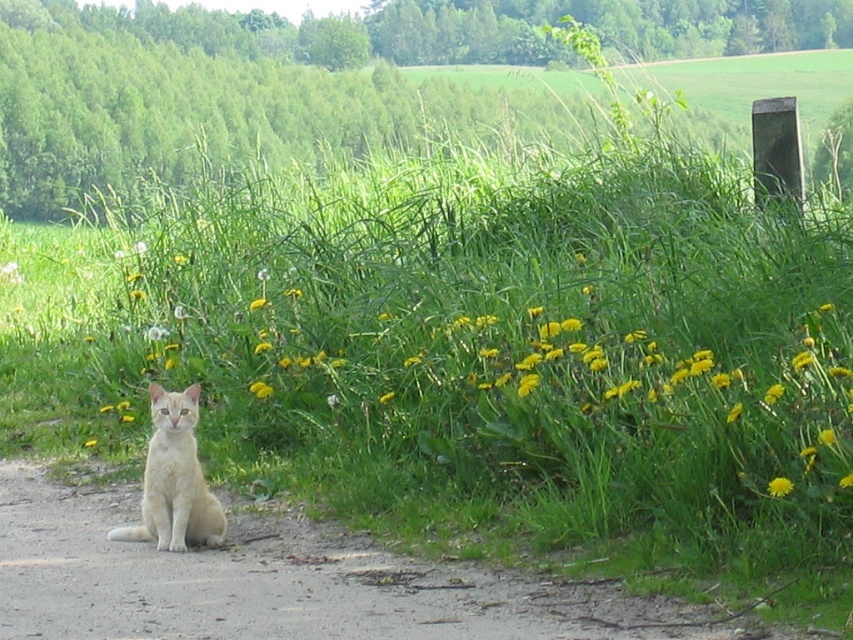
You are a small toy car that is 10 cm tall. You want to drive from the brown dirt track at lower left to the yellow matte flower at lower right. Can you pass under the space between them without hitting your head?

The brown dirt track at lower left is taller than the yellow matte flower at lower right. Since the toy car is 10 cm tall, it might hit the lower part of the brown dirt track at lower left, so it cannot pass safely.

You are a small robot with a width of 30 cm. You need to navigate from the brown dirt track at lower left to the yellow matte flower at lower right. Can you pass through the space between them without any obstacles?

The brown dirt track at lower left is bigger than the yellow matte flower at lower right, but the question is about navigating between them. The description does not provide information about the distance between them or any obstacles in the path. Therefore, it is unclear if the robot can pass through safely. More information about the space between them is needed.

You are standing at the point marked by the coordinates point (173, 480) in the image. Looking around, you see a light beige fur cat at lower left. Which direction should you walk to reach the cat?

The point (173, 480) marks the light beige fur cat at lower left, so you are already at the cat.